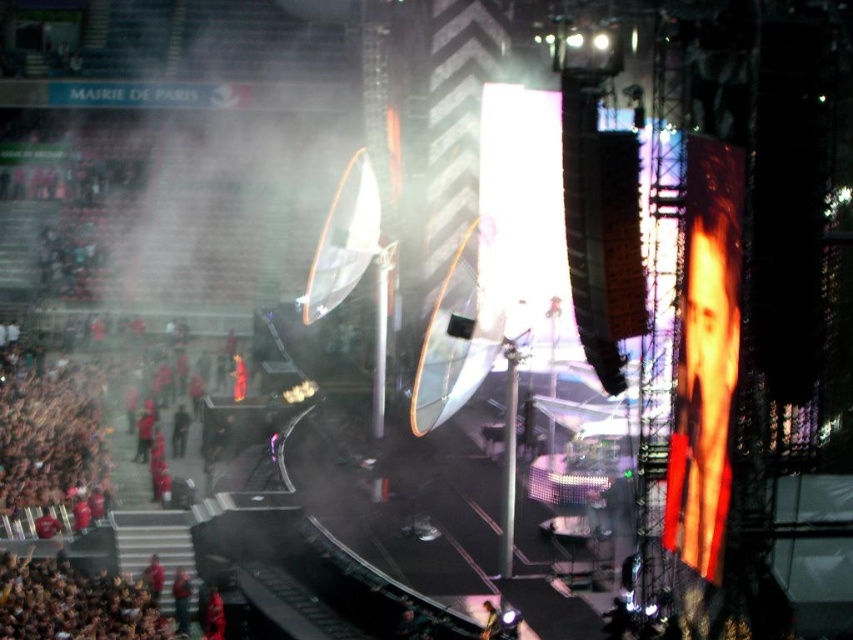
Does point (187, 620) lie in front of point (222, 628)?

No.

You are a GUI agent. You are given a task and a screenshot of the screen. Output one action in this format:
    pyautogui.click(x=<x>, y=<y>)
    Task: Click on the red fabric jacket at lower left
    
    Given the screenshot: What is the action you would take?
    pyautogui.click(x=181, y=600)

You are a GUI agent. You are given a task and a screenshot of the screen. Output one action in this format:
    pyautogui.click(x=<x>, y=<y>)
    Task: Click on the red fabric jacket at lower left
    The width and height of the screenshot is (853, 640).
    Given the screenshot: What is the action you would take?
    pyautogui.click(x=181, y=600)

The height and width of the screenshot is (640, 853). In order to click on red fabric jacket at lower left in this screenshot , I will do `click(181, 600)`.

Is red fabric jacket at lower left to the left of shiny black guitar at center from the viewer's perspective?

Indeed, red fabric jacket at lower left is positioned on the left side of shiny black guitar at center.

Does red fabric jacket at lower left appear on the right side of shiny black guitar at center?

No, red fabric jacket at lower left is not to the right of shiny black guitar at center.

Is point (177, 577) positioned behind point (486, 605)?

That is True.

The height and width of the screenshot is (640, 853). In order to click on red fabric jacket at lower left in this screenshot , I will do `click(181, 600)`.

Does red fabric person at lower left have a smaller size compared to shiny black guitar at center?

No.

Does red fabric person at lower left have a greater height compared to shiny black guitar at center?

Yes, red fabric person at lower left is taller than shiny black guitar at center.

This screenshot has height=640, width=853. Identify the location of red fabric person at lower left. [x=213, y=616].